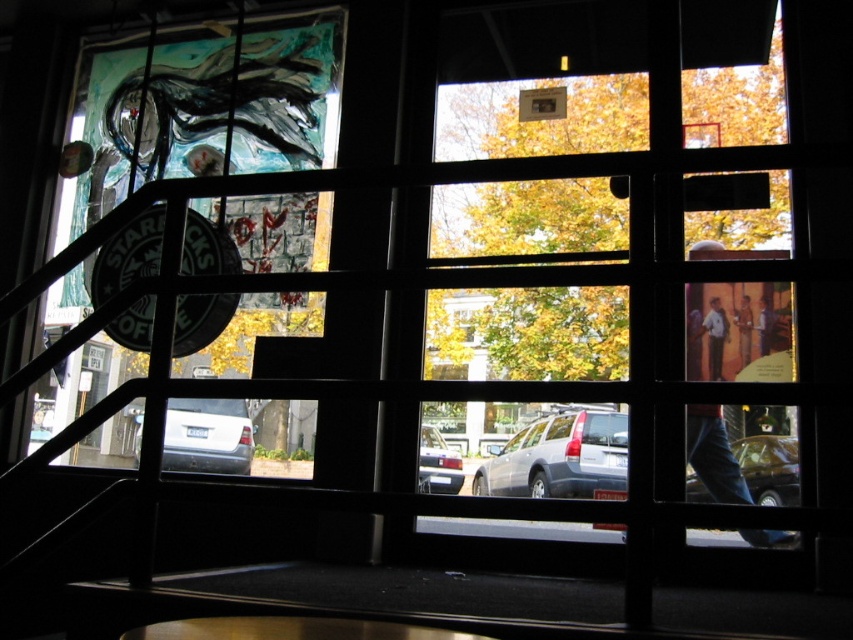
You are standing in a room with a window. You see denim pants at lower right. Where exactly are the denim pants located in the room?

The denim pants at lower right are located at the 2D coordinates point (x=712, y=454) in the room.

Consider the image. You are standing inside a room and looking through the window at the denim pants at lower right and the metallic silver car at lower right. Which object is nearer to you?

The denim pants at lower right is closer to the viewer than the metallic silver car at lower right.

You are standing inside a room with a window and see a satin silver car at center and a khaki cotton pants at center. Which object is located more to the left side?

The satin silver car at center is positioned on the left side of khaki cotton pants at center, so it is more to the left.